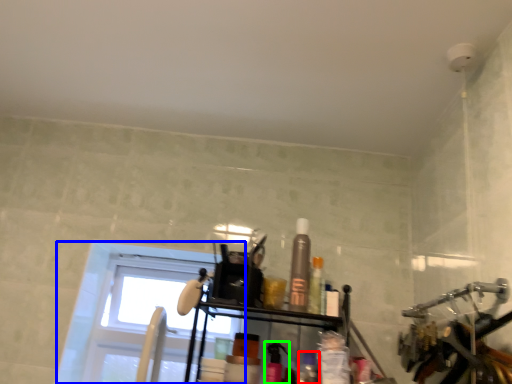
Question: Which object is the closest to the toiletry (highlighted by a red box)? Choose among these: window (highlighted by a blue box) or toiletry (highlighted by a green box).

Choices:
 (A) window
 (B) toiletry

Answer: (B)